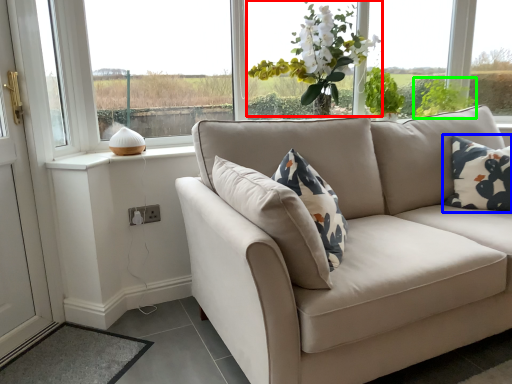
Question: Which object is positioned farthest from floral arrangement (highlighted by a red box)? Select from pillow (highlighted by a blue box) and plant (highlighted by a green box).

Choices:
 (A) pillow
 (B) plant

Answer: (A)